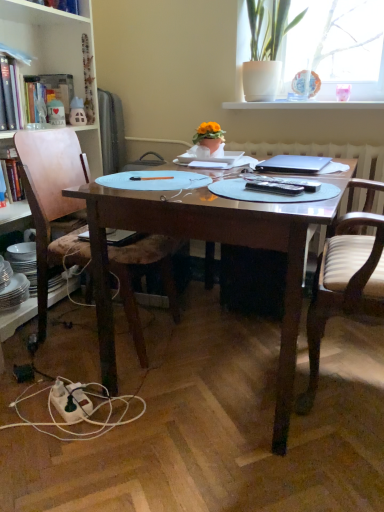
Where is `vacant space underneath wooden desk at center (from a real-world perspective)`? The image size is (384, 512). vacant space underneath wooden desk at center (from a real-world perspective) is located at coordinates (222, 361).